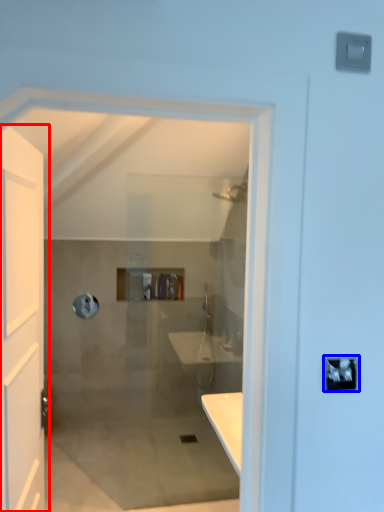
Question: Which object is further to the camera taking this photo, door (highlighted by a red box) or lock (highlighted by a blue box)?

Choices:
 (A) door
 (B) lock

Answer: (B)